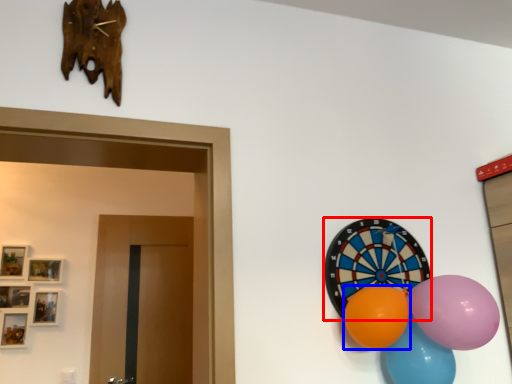
Question: Which object is closer to the camera taking this photo, oval (highlighted by a red box) or balloon (highlighted by a blue box)?

Choices:
 (A) oval
 (B) balloon

Answer: (B)